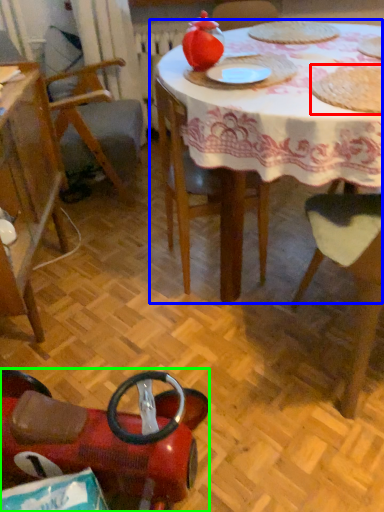
Question: Estimate the real-world distances between objects in this image. Which object is closer to food (highlighted by a red box), table (highlighted by a blue box) or chair (highlighted by a green box)?

Choices:
 (A) table
 (B) chair

Answer: (A)